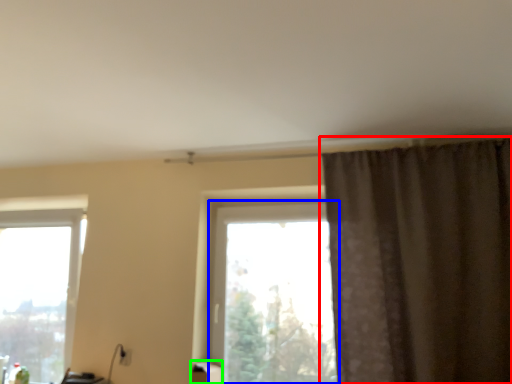
Question: Which object is the farthest from curtain (highlighted by a red box)? Choose among these: window (highlighted by a blue box) or furniture (highlighted by a green box).

Choices:
 (A) window
 (B) furniture

Answer: (B)